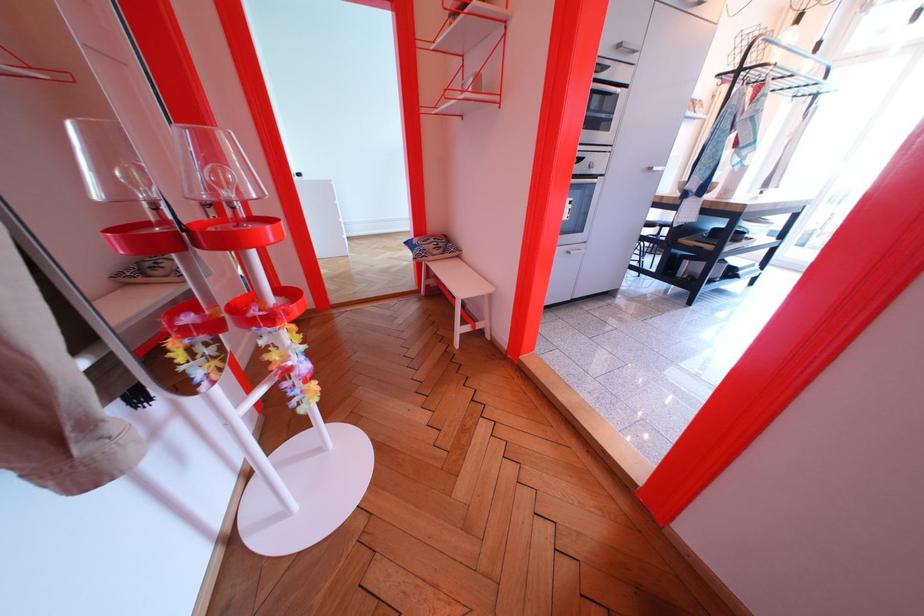
You are a GUI agent. You are given a task and a screenshot of the screen. Output one action in this format:
    pyautogui.click(x=<x>, y=<y>)
    Task: Click on the cabinet door handle
    This screenshot has height=616, width=924.
    Given the screenshot: What is the action you would take?
    pyautogui.click(x=653, y=169)